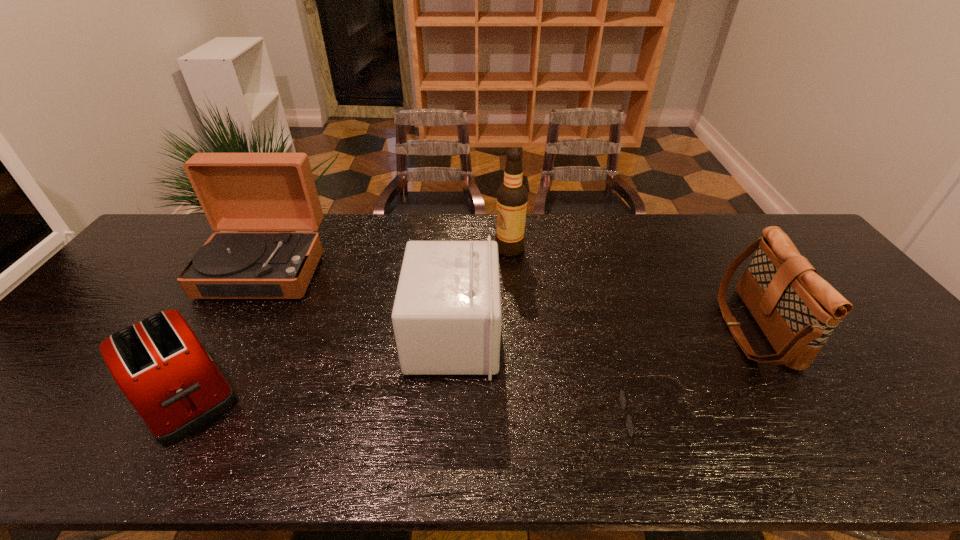
Where is `the fourth object from left to right`? The image size is (960, 540). the fourth object from left to right is located at coordinates (512, 196).

The width and height of the screenshot is (960, 540). Find the location of `phonograph record`. phonograph record is located at coordinates (237, 191).

The width and height of the screenshot is (960, 540). I want to click on the fourth object from right to left, so click(446, 317).

At what (x,y) coordinates should I click in order to perform the action: click on the rightmost object. Please return your answer as a coordinate pair (x, y). The width and height of the screenshot is (960, 540). Looking at the image, I should click on (797, 310).

Locate an element on the screen. the second shortest object is located at coordinates (160, 365).

At what (x,y) coordinates should I click in order to perform the action: click on the shortest object. Please return your answer as a coordinate pair (x, y). Looking at the image, I should click on (622, 397).

I want to click on spectacles, so click(622, 397).

This screenshot has height=540, width=960. I want to click on free point located on the label of the fourth object from left to right, so click(x=445, y=249).

Find the location of a particular element. Image resolution: width=960 pixels, height=540 pixels. vacant point located 0.330m on the label of the fourth object from left to right is located at coordinates (394, 249).

Find the location of a particular element. vacant space located on the label of the fourth object from left to right is located at coordinates (461, 249).